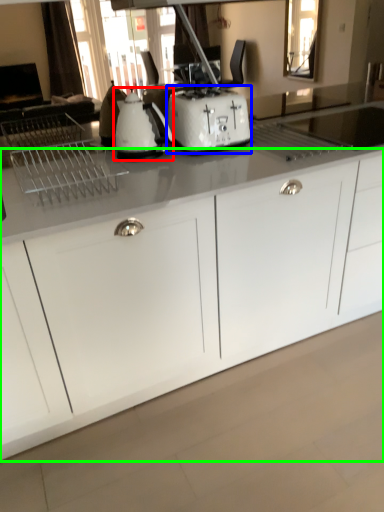
Question: Based on their relative distances, which object is nearer to kitchen appliance (highlighted by a red box)? Choose from toaster (highlighted by a blue box) and cabinetry (highlighted by a green box).

Choices:
 (A) toaster
 (B) cabinetry

Answer: (A)